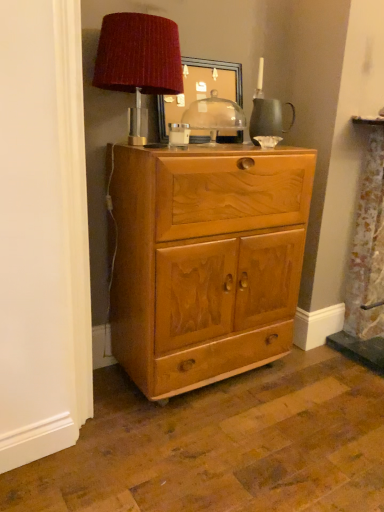
Question: Is wooden picture frame at upper center facing away from velvet red lampshade at upper center?

Choices:
 (A) no
 (B) yes

Answer: (A)

Question: Is wooden picture frame at upper center behind velvet red lampshade at upper center?

Choices:
 (A) no
 (B) yes

Answer: (B)

Question: Is wooden picture frame at upper center with velvet red lampshade at upper center?

Choices:
 (A) yes
 (B) no

Answer: (B)

Question: Is wooden picture frame at upper center to the right of velvet red lampshade at upper center from the viewer's perspective?

Choices:
 (A) no
 (B) yes

Answer: (B)

Question: Considering the relative sizes of wooden picture frame at upper center and velvet red lampshade at upper center in the image provided, is wooden picture frame at upper center thinner than velvet red lampshade at upper center?

Choices:
 (A) yes
 (B) no

Answer: (A)

Question: From the image's perspective, is wooden picture frame at upper center located above or below light brown wood cabinet at center?

Choices:
 (A) above
 (B) below

Answer: (A)

Question: Based on their positions, is wooden picture frame at upper center located to the left or right of light brown wood cabinet at center?

Choices:
 (A) right
 (B) left

Answer: (B)

Question: From their relative heights in the image, would you say wooden picture frame at upper center is taller or shorter than light brown wood cabinet at center?

Choices:
 (A) short
 (B) tall

Answer: (A)

Question: Based on their sizes in the image, would you say wooden picture frame at upper center is bigger or smaller than light brown wood cabinet at center?

Choices:
 (A) big
 (B) small

Answer: (B)

Question: Is transparent glass dome at center in front of or behind velvet red lampshade at upper center in the image?

Choices:
 (A) behind
 (B) front

Answer: (A)

Question: Is point (195, 129) positioned closer to the camera than point (94, 83)?

Choices:
 (A) farther
 (B) closer

Answer: (A)

Question: Is transparent glass dome at center inside or outside of velvet red lampshade at upper center?

Choices:
 (A) inside
 (B) outside

Answer: (B)

Question: In terms of size, does transparent glass dome at center appear bigger or smaller than velvet red lampshade at upper center?

Choices:
 (A) big
 (B) small

Answer: (B)

Question: Is wooden picture frame at upper center inside the boundaries of velvet red lampshade at upper center, or outside?

Choices:
 (A) outside
 (B) inside

Answer: (A)

Question: Considering the relative positions of wooden picture frame at upper center and velvet red lampshade at upper center in the image provided, is wooden picture frame at upper center to the left or to the right of velvet red lampshade at upper center?

Choices:
 (A) left
 (B) right

Answer: (B)